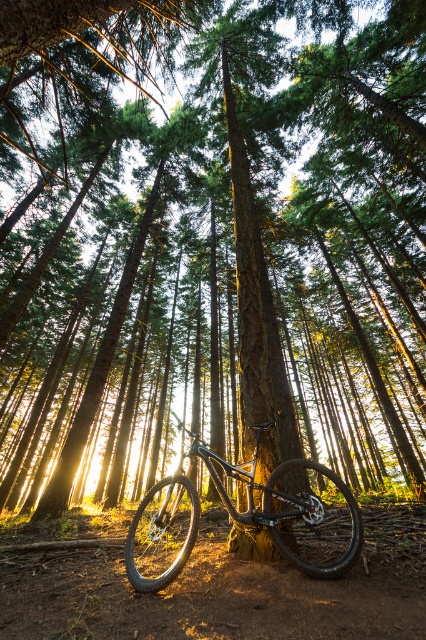
Question: Is dirt track at center positioned at the back of glossy metallic bicycle at center?

Choices:
 (A) no
 (B) yes

Answer: (A)

Question: Does dirt track at center appear on the left side of glossy metallic bicycle at center?

Choices:
 (A) no
 (B) yes

Answer: (A)

Question: Which point is farther from the camera taking this photo?

Choices:
 (A) (386, 560)
 (B) (271, 426)

Answer: (B)

Question: Can you confirm if dirt track at center is positioned to the left of glossy metallic bicycle at center?

Choices:
 (A) no
 (B) yes

Answer: (A)

Question: Which object is closer to the camera taking this photo?

Choices:
 (A) dirt track at center
 (B) glossy metallic bicycle at center

Answer: (A)